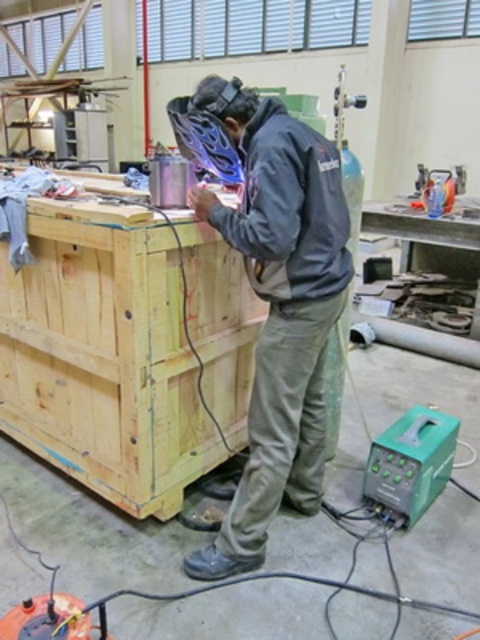
Can you confirm if yellow wood crate at center is positioned above dark gray jacket at center?

No.

Find the location of `yellow wood crate at center`. yellow wood crate at center is located at coordinates click(x=124, y=349).

The width and height of the screenshot is (480, 640). Describe the element at coordinates (124, 349) in the screenshot. I see `yellow wood crate at center` at that location.

Image resolution: width=480 pixels, height=640 pixels. I want to click on yellow wood crate at center, so click(124, 349).

Can you confirm if blue metallic helmet at center is positioned to the left of dark gray jacket at center?

Correct, you'll find blue metallic helmet at center to the left of dark gray jacket at center.

Which is behind, point (320, 138) or point (319, 164)?

The point (320, 138) is more distant.

Between point (268, 156) and point (302, 280), which one is positioned behind?

Positioned behind is point (302, 280).

Where is `blue metallic helmet at center`? The height and width of the screenshot is (640, 480). blue metallic helmet at center is located at coordinates (273, 296).

Can you confirm if yellow wood crate at center is thinner than blue metallic helmet at center?

No, yellow wood crate at center is not thinner than blue metallic helmet at center.

From the picture: Is yellow wood crate at center closer to the viewer compared to blue metallic helmet at center?

No, yellow wood crate at center is further to the viewer.

Who is more forward, (x=122, y=422) or (x=297, y=120)?

Point (x=297, y=120)

Where is `yellow wood crate at center`? yellow wood crate at center is located at coordinates (124, 349).